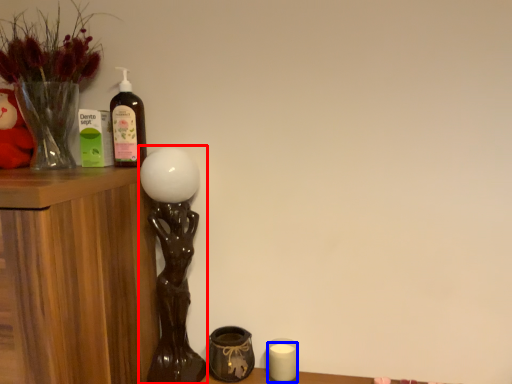
Question: Which object is closer to the camera taking this photo, table lamp (highlighted by a red box) or candle (highlighted by a blue box)?

Choices:
 (A) table lamp
 (B) candle

Answer: (A)